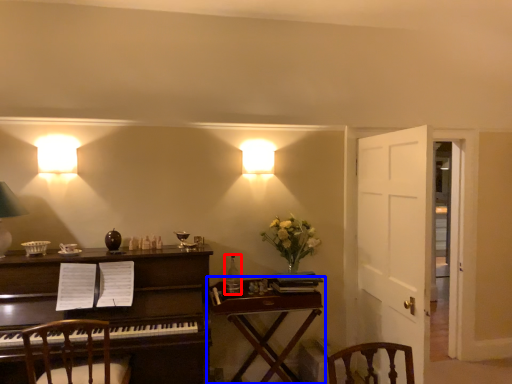
Question: Among these objects, which one is nearest to the camera, bottle (highlighted by a red box) or table (highlighted by a blue box)?

Choices:
 (A) bottle
 (B) table

Answer: (B)